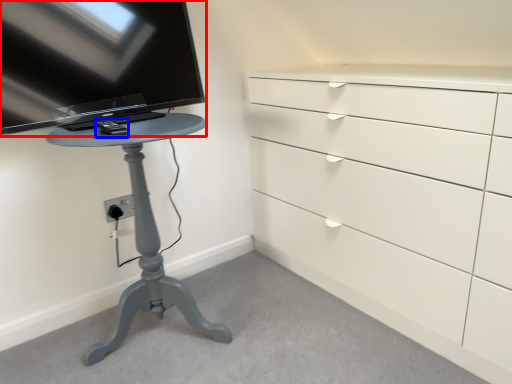
Question: Among these objects, which one is nearest to the camera, television (highlighted by a red box) or equipment (highlighted by a blue box)?

Choices:
 (A) television
 (B) equipment

Answer: (A)